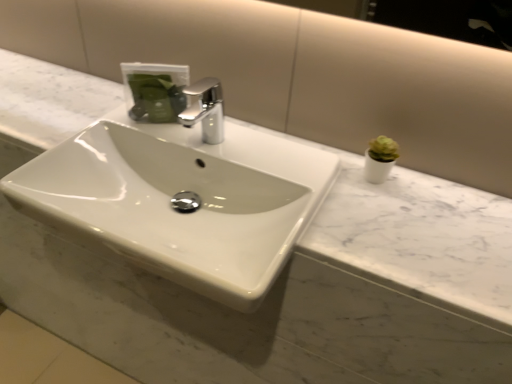
Where is `spots to the right of chrome metallic faucet at center`? spots to the right of chrome metallic faucet at center is located at coordinates (262, 153).